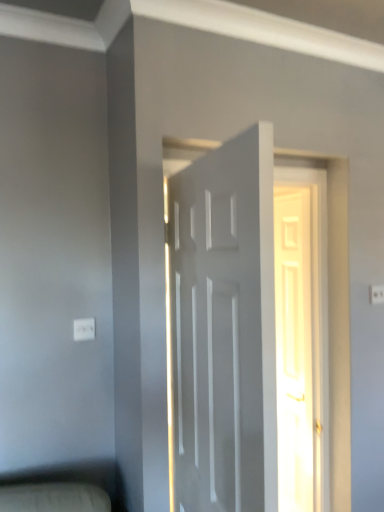
What do you see at coordinates (84, 329) in the screenshot? Image resolution: width=384 pixels, height=512 pixels. I see `white plastic electric outlet at lower left, which is the 2th electric outlet in top-to-bottom order` at bounding box center [84, 329].

This screenshot has height=512, width=384. Identify the location of white matte door at center, which is the first door from left to right. (243, 330).

Describe the element at coordinates (376, 294) in the screenshot. I see `white plastic electric outlet at upper right, the first electric outlet viewed from the back` at that location.

At what (x,y) coordinates should I click in order to perform the action: click on white plastic electric outlet at upper right, which is the 2th electric outlet from front to back. Please return your answer as a coordinate pair (x, y). Image resolution: width=384 pixels, height=512 pixels. Looking at the image, I should click on (376, 294).

This screenshot has height=512, width=384. What do you see at coordinates (297, 347) in the screenshot?
I see `white glossy door at center, the second door when ordered from front to back` at bounding box center [297, 347].

In order to click on white plastic electric outlet at lower left, which is the first electric outlet from bottom to top in this screenshot , I will do `click(84, 329)`.

From a real-world perspective, relative to white matte door at center, which is the first door from left to right, is white glossy door at center, the first door viewed from the right, vertically above or below?

white glossy door at center, the first door viewed from the right, is below white matte door at center, which is the first door from left to right.

Would you say white glossy door at center, which ranks as the second door in left-to-right order, is outside white matte door at center, the 2th door viewed from the back?

Yes, white glossy door at center, which ranks as the second door in left-to-right order, is located beyond the bounds of white matte door at center, the 2th door viewed from the back.

Is white matte door at center, marked as the first door in a front-to-back arrangement, facing towards white plastic electric outlet at upper right, which is the 2th electric outlet from front to back?

Yes.

Image resolution: width=384 pixels, height=512 pixels. I want to click on door in front of the white plastic electric outlet at upper right, which is the 2th electric outlet from front to back, so click(x=243, y=330).

In the scene shown: Is white matte door at center, marked as the first door in a front-to-back arrangement, next to white plastic electric outlet at upper right, positioned as the first electric outlet in right-to-left order?

No, white matte door at center, marked as the first door in a front-to-back arrangement, is not beside white plastic electric outlet at upper right, positioned as the first electric outlet in right-to-left order.

How distant is white plastic electric outlet at lower left, which is counted as the first electric outlet, starting from the front, from white glossy door at center, the second door when ordered from front to back?

4.11 feet.

Can you confirm if white plastic electric outlet at lower left, which is the 2th electric outlet in top-to-bottom order, is bigger than white glossy door at center, the second door when ordered from front to back?

No.

Is white plastic electric outlet at lower left, which is the first electric outlet from bottom to top, completely or partially outside of white glossy door at center, the second door when ordered from front to back?

Yes, white plastic electric outlet at lower left, which is the first electric outlet from bottom to top, is located beyond the bounds of white glossy door at center, the second door when ordered from front to back.

From a real-world perspective, who is located lower, white plastic electric outlet at lower left, which is counted as the first electric outlet, starting from the front, or white glossy door at center, which ranks as the second door in left-to-right order?

From a 3D spatial view, white glossy door at center, which ranks as the second door in left-to-right order, is below.

From their relative heights in the image, would you say white matte door at center, the 2th door viewed from the back, is taller or shorter than white glossy door at center, the second door when ordered from front to back?

white matte door at center, the 2th door viewed from the back, is shorter than white glossy door at center, the second door when ordered from front to back.

Is the depth of white matte door at center, marked as the first door in a front-to-back arrangement, less than that of white glossy door at center, which ranks as the second door in left-to-right order?

Yes, white matte door at center, marked as the first door in a front-to-back arrangement, is in front of white glossy door at center, which ranks as the second door in left-to-right order.

From the image's perspective, which is above, white matte door at center, which is the first door from left to right, or white glossy door at center, the second door when ordered from front to back?

From the image's view, white matte door at center, which is the first door from left to right, is above.

Considering the relative positions of white matte door at center, marked as the first door in a front-to-back arrangement, and white glossy door at center, placed as the first door when sorted from back to front, in the image provided, is white matte door at center, marked as the first door in a front-to-back arrangement, to the right of white glossy door at center, placed as the first door when sorted from back to front, from the viewer's perspective?

In fact, white matte door at center, marked as the first door in a front-to-back arrangement, is to the left of white glossy door at center, placed as the first door when sorted from back to front.

In the scene shown: Is white plastic electric outlet at upper right, which is the 2th electric outlet from front to back, a part of white glossy door at center, which ranks as the second door in left-to-right order?

No, white plastic electric outlet at upper right, which is the 2th electric outlet from front to back, is not surrounded by white glossy door at center, which ranks as the second door in left-to-right order.

Is white glossy door at center, the first door viewed from the right, to the right of white plastic electric outlet at upper right, which is the second electric outlet from bottom to top, from the viewer's perspective?

No, white glossy door at center, the first door viewed from the right, is not to the right of white plastic electric outlet at upper right, which is the second electric outlet from bottom to top.

From the image's perspective, is white glossy door at center, placed as the first door when sorted from back to front, positioned above or below white plastic electric outlet at upper right, which is the second electric outlet from bottom to top?

A: white glossy door at center, placed as the first door when sorted from back to front, is situated lower than white plastic electric outlet at upper right, which is the second electric outlet from bottom to top, in the image.

From a real-world perspective, between white matte door at center, the 2th door viewed from the back, and white plastic electric outlet at lower left, which is the second electric outlet in back-to-front order, who is vertically higher?

From a 3D spatial view, white plastic electric outlet at lower left, which is the second electric outlet in back-to-front order, is above.

Is white matte door at center, marked as the first door in a front-to-back arrangement, turned away from white plastic electric outlet at lower left, marked as the 1th electric outlet in a left-to-right arrangement?

No.

Considering the relative positions of white matte door at center, which is the first door from left to right, and white plastic electric outlet at lower left, which is the 2th electric outlet in top-to-bottom order, in the image provided, is white matte door at center, which is the first door from left to right, to the left of white plastic electric outlet at lower left, which is the 2th electric outlet in top-to-bottom order, from the viewer's perspective?

No, white matte door at center, which is the first door from left to right, is not to the left of white plastic electric outlet at lower left, which is the 2th electric outlet in top-to-bottom order.

What are the coordinates of `the 1st door below the white plastic electric outlet at lower left, which is counted as the first electric outlet, starting from the front (from the image's perspective)` in the screenshot? It's located at (243, 330).

Would you say white plastic electric outlet at lower left, which is the first electric outlet from bottom to top, is part of white plastic electric outlet at upper right, positioned as the first electric outlet in right-to-left order,'s contents?

Actually, white plastic electric outlet at lower left, which is the first electric outlet from bottom to top, is outside white plastic electric outlet at upper right, positioned as the first electric outlet in right-to-left order.

Is white plastic electric outlet at upper right, the first electric outlet viewed from the back, turned away from white plastic electric outlet at lower left, which is counted as the first electric outlet, starting from the front?

No.

Looking at this image, from the image's perspective, does white plastic electric outlet at upper right, arranged as the 2th electric outlet when viewed from the left, appear lower than white plastic electric outlet at lower left, which is counted as the first electric outlet, starting from the front?

Actually, white plastic electric outlet at upper right, arranged as the 2th electric outlet when viewed from the left, appears above white plastic electric outlet at lower left, which is counted as the first electric outlet, starting from the front, in the image.

From the picture: From a real-world perspective, who is located lower, white plastic electric outlet at upper right, which appears as the first electric outlet when viewed from the top, or white plastic electric outlet at lower left, which is the first electric outlet from bottom to top?

From a 3D spatial view, white plastic electric outlet at lower left, which is the first electric outlet from bottom to top, is below.

At what (x,y) coordinates should I click in order to perform the action: click on door below the white matte door at center, marked as the first door in a front-to-back arrangement (from the image's perspective). Please return your answer as a coordinate pair (x, y). The height and width of the screenshot is (512, 384). Looking at the image, I should click on click(x=297, y=347).

Find the location of `door that is the 2nd object to the left of the white plastic electric outlet at upper right, which appears as the first electric outlet when viewed from the top, starting at the anchor`. door that is the 2nd object to the left of the white plastic electric outlet at upper right, which appears as the first electric outlet when viewed from the top, starting at the anchor is located at coordinates (243, 330).

When comparing their distances from white plastic electric outlet at upper right, the first electric outlet viewed from the back, does white plastic electric outlet at lower left, which is counted as the first electric outlet, starting from the front, or white matte door at center, which is the first door from left to right, seem closer?

white matte door at center, which is the first door from left to right, is closer to white plastic electric outlet at upper right, the first electric outlet viewed from the back.

Which object lies further to the anchor point white matte door at center, marked as the first door in a front-to-back arrangement, white plastic electric outlet at lower left, placed as the second electric outlet when sorted from right to left, or white glossy door at center, placed as the first door when sorted from back to front?

white glossy door at center, placed as the first door when sorted from back to front, lies further to white matte door at center, marked as the first door in a front-to-back arrangement, than the other object.

Looking at the image, which one is located further to white plastic electric outlet at lower left, which is the second electric outlet in back-to-front order, white plastic electric outlet at upper right, which appears as the first electric outlet when viewed from the top, or white matte door at center, the 2th door viewed from the back?

white plastic electric outlet at upper right, which appears as the first electric outlet when viewed from the top, lies further to white plastic electric outlet at lower left, which is the second electric outlet in back-to-front order, than the other object.

From the image, which object appears to be farther from white plastic electric outlet at upper right, positioned as the first electric outlet in right-to-left order, white plastic electric outlet at lower left, which is the first electric outlet from bottom to top, or white glossy door at center, placed as the first door when sorted from back to front?

white plastic electric outlet at lower left, which is the first electric outlet from bottom to top.

Which object lies further to the anchor point white matte door at center, the 2th door viewed from the back, white glossy door at center, the second door when ordered from front to back, or white plastic electric outlet at upper right, which is the 2th electric outlet from front to back?

white glossy door at center, the second door when ordered from front to back, lies further to white matte door at center, the 2th door viewed from the back, than the other object.

Looking at the image, which one is located closer to white plastic electric outlet at upper right, which is the second electric outlet from bottom to top, white matte door at center, the 2th door viewed from the back, or white glossy door at center, the second door when ordered from front to back?

Based on the image, white glossy door at center, the second door when ordered from front to back, appears to be nearer to white plastic electric outlet at upper right, which is the second electric outlet from bottom to top.

Which object lies nearer to the anchor point white plastic electric outlet at lower left, marked as the 1th electric outlet in a left-to-right arrangement, white glossy door at center, which ranks as the second door in left-to-right order, or white matte door at center, which is the first door from left to right?

white matte door at center, which is the first door from left to right, lies closer to white plastic electric outlet at lower left, marked as the 1th electric outlet in a left-to-right arrangement, than the other object.

Based on the photo, looking at the image, which one is located further to white plastic electric outlet at lower left, marked as the 1th electric outlet in a left-to-right arrangement, white glossy door at center, which ranks as the second door in left-to-right order, or white plastic electric outlet at upper right, which is the 2th electric outlet from front to back?

Among the two, white glossy door at center, which ranks as the second door in left-to-right order, is located further to white plastic electric outlet at lower left, marked as the 1th electric outlet in a left-to-right arrangement.